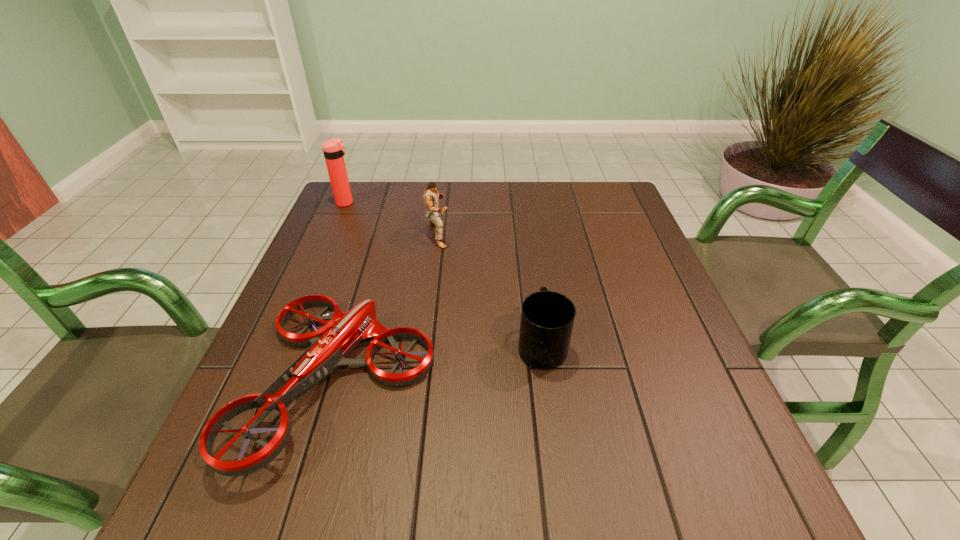
Image resolution: width=960 pixels, height=540 pixels. In the image, there is a desktop. Find the location of `vacant space at the left edge`. vacant space at the left edge is located at coordinates (289, 292).

I want to click on free region at the right edge of the desktop, so click(x=713, y=428).

Find the location of a particular element. The width and height of the screenshot is (960, 540). free region at the far left corner is located at coordinates (363, 193).

This screenshot has width=960, height=540. In order to click on free spot at the far right corner of the desktop in this screenshot , I will do `click(615, 202)`.

At what (x,y) coordinates should I click in order to perform the action: click on empty space that is in between the second farthest object and the tallest object. Please return your answer as a coordinate pair (x, y). The width and height of the screenshot is (960, 540). Looking at the image, I should click on (392, 219).

Image resolution: width=960 pixels, height=540 pixels. I want to click on free space between the drone and the rightmost object, so click(442, 362).

At what (x,y) coordinates should I click in order to perform the action: click on unoccupied area between the rightmost object and the shortest object. Please return your answer as a coordinate pair (x, y). This screenshot has width=960, height=540. Looking at the image, I should click on (442, 362).

Locate an element on the screen. The width and height of the screenshot is (960, 540). vacant point located between the puncher and the second shortest object is located at coordinates (x=490, y=291).

The height and width of the screenshot is (540, 960). In order to click on free area in between the rightmost object and the thermos bottle in this screenshot , I will do `click(444, 274)`.

Locate an element on the screen. empty space that is in between the thermos bottle and the mug is located at coordinates (444, 274).